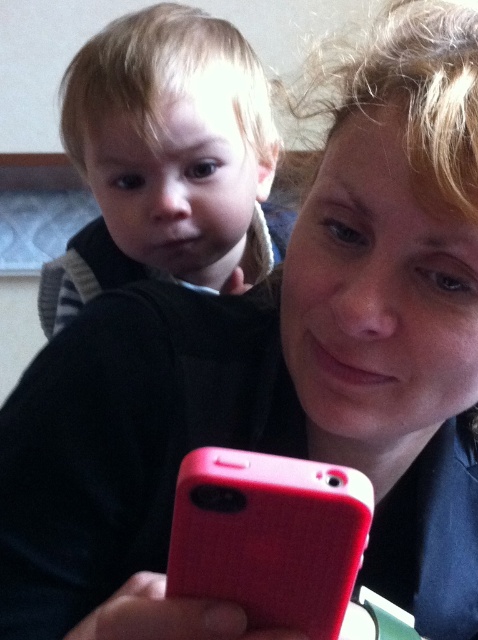
Question: Is smooth blond hair toddler at upper left to the right of rubberized red phone at lower center from the viewer's perspective?

Choices:
 (A) yes
 (B) no

Answer: (B)

Question: Which point appears farthest from the camera in this image?

Choices:
 (A) (338, 595)
 (B) (187, 148)

Answer: (B)

Question: Can you confirm if smooth blond hair toddler at upper left is bigger than rubberized red phone at lower center?

Choices:
 (A) yes
 (B) no

Answer: (A)

Question: Is smooth blond hair toddler at upper left wider than rubberized red phone at lower center?

Choices:
 (A) yes
 (B) no

Answer: (A)

Question: Which point is closer to the camera?

Choices:
 (A) (194, 588)
 (B) (116, 189)

Answer: (A)